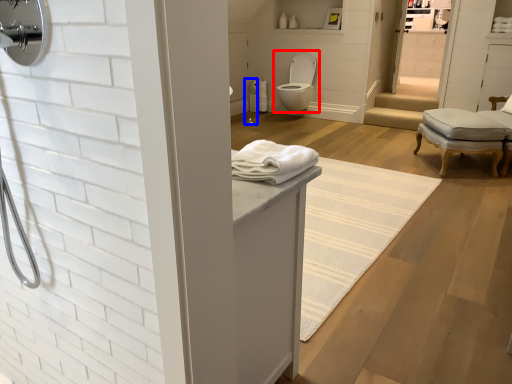
Question: Which object is further to the camera taking this photo, toilet (highlighted by a red box) or shower (highlighted by a blue box)?

Choices:
 (A) toilet
 (B) shower

Answer: (B)